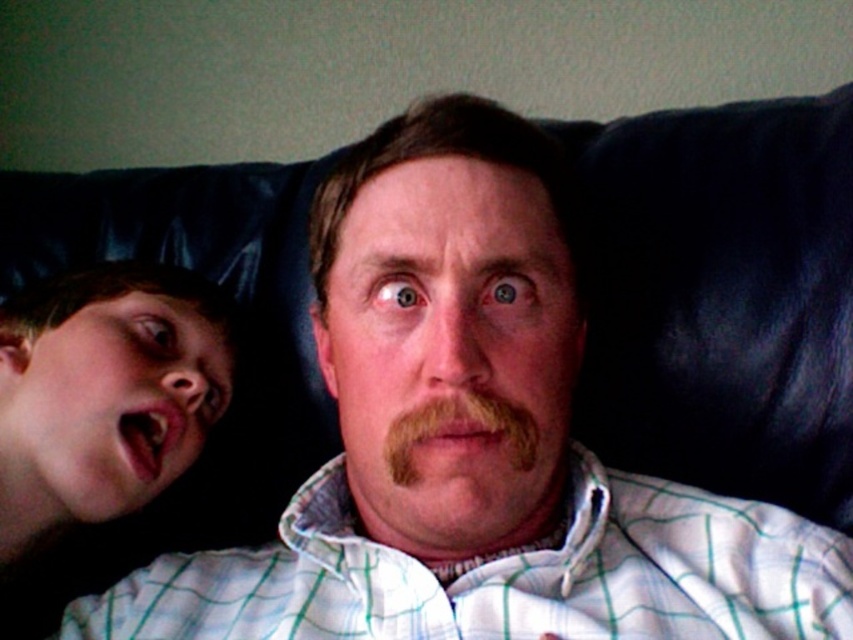
Question: Does smooth skin face at left appear under brown fuzzy mustache at center?

Choices:
 (A) no
 (B) yes

Answer: (A)

Question: Which of the following is the closest to the observer?

Choices:
 (A) (386, 451)
 (B) (143, 374)
 (C) (282, 266)

Answer: (A)

Question: Does smooth skin face at left have a larger size compared to brown fuzzy mustache at center?

Choices:
 (A) no
 (B) yes

Answer: (B)

Question: Which point is farther from the camera taking this photo?

Choices:
 (A) pos(529,412)
 (B) pos(196,449)
 (C) pos(634,208)

Answer: (B)

Question: Does smooth skin face at left have a lesser width compared to brown fuzzy mustache at center?

Choices:
 (A) yes
 (B) no

Answer: (B)

Question: Which point is closer to the camera taking this photo?

Choices:
 (A) (x=199, y=412)
 (B) (x=119, y=225)
 (C) (x=515, y=422)

Answer: (C)